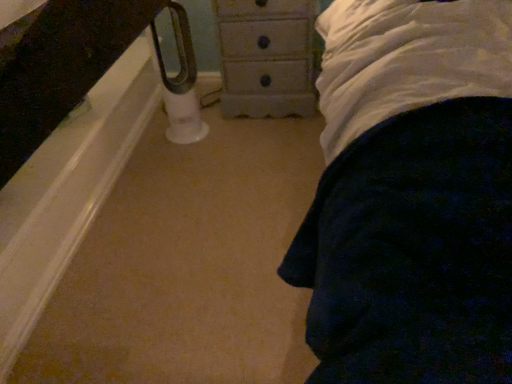
Locate an element on the screen. This screenshot has height=384, width=512. free point in front of white plastic towel bar at lower left is located at coordinates (186, 158).